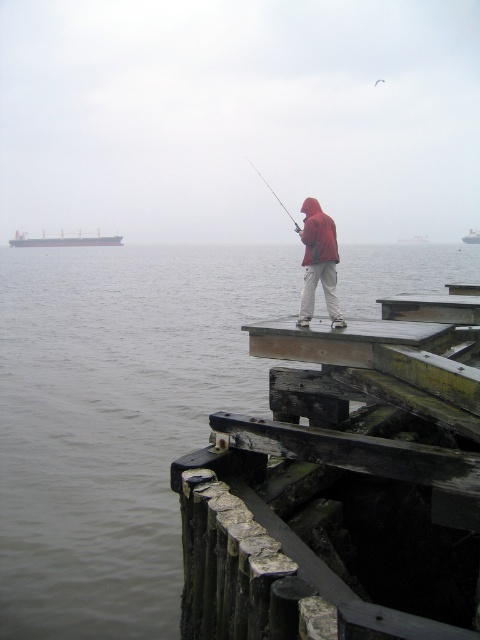
Question: Which is nearer to the matte red jacket at center?

Choices:
 (A) gray water at center
 (B) gray matte cargo ship at left
 (C) metallic gray ship at upper left
 (D) metallic gray ship at center

Answer: (A)

Question: Which object is positioned closest to the matte red jacket at center?

Choices:
 (A) gray matte cargo ship at left
 (B) metallic gray ship at upper left

Answer: (A)

Question: Which object appears farthest from the camera in this image?

Choices:
 (A) gray water at center
 (B) matte red jacket at center
 (C) metallic gray ship at upper left
 (D) gray matte cargo ship at left

Answer: (C)

Question: Is gray matte cargo ship at left closer to camera compared to smooth metallic fishing pole at center?

Choices:
 (A) no
 (B) yes

Answer: (A)

Question: Does matte red jacket at center lie in front of smooth metallic fishing pole at center?

Choices:
 (A) yes
 (B) no

Answer: (A)

Question: Can you confirm if matte red jacket at center is smaller than smooth metallic fishing pole at center?

Choices:
 (A) yes
 (B) no

Answer: (A)